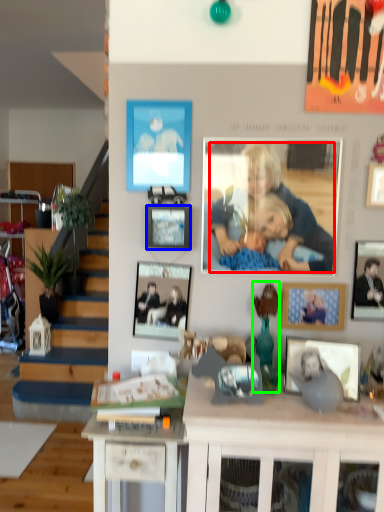
Question: Which object is positioned closest to person (highlighted by a red box)? Select from picture frame (highlighted by a blue box) and toy (highlighted by a green box).

Choices:
 (A) picture frame
 (B) toy

Answer: (A)